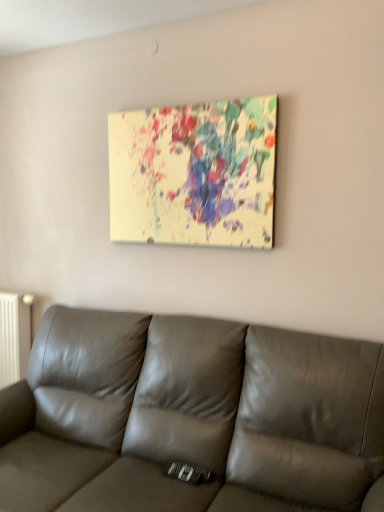
Question: From a real-world perspective, is painted canvas at upper center positioned above or below white matte radiator at left?

Choices:
 (A) below
 (B) above

Answer: (B)

Question: In terms of height, does painted canvas at upper center look taller or shorter compared to white matte radiator at left?

Choices:
 (A) tall
 (B) short

Answer: (B)

Question: Estimate the real-world distances between objects in this image. Which object is farther from the white matte radiator at left?

Choices:
 (A) leather couch at center
 (B) painted canvas at upper center

Answer: (B)

Question: Estimate the real-world distances between objects in this image. Which object is closer to the leather couch at center?

Choices:
 (A) painted canvas at upper center
 (B) white matte radiator at left

Answer: (A)